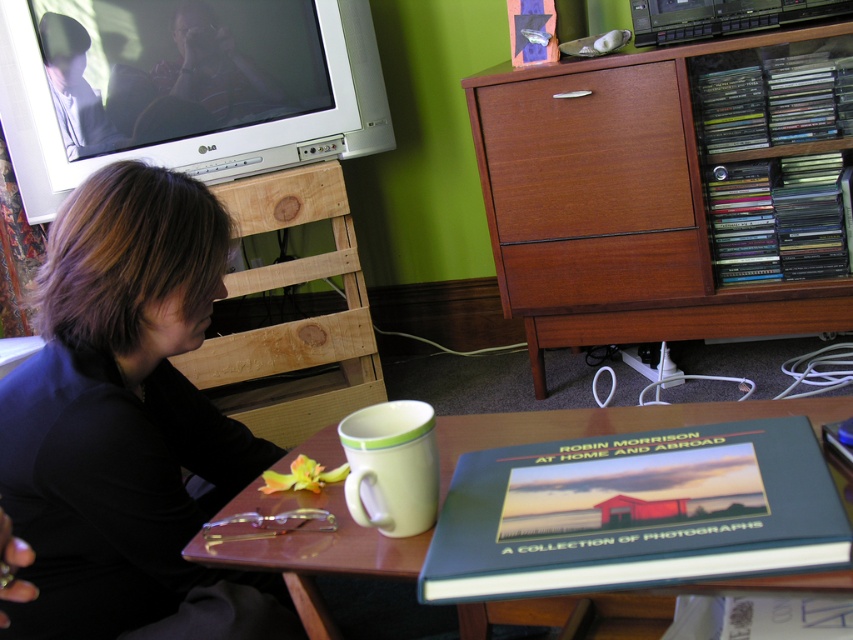
Question: Which of the following is the farthest from the observer?

Choices:
 (A) wooden drawer at upper right
 (B) wooden cabinet at upper right

Answer: (A)

Question: Which object appears closest to the camera in this image?

Choices:
 (A) wooden cabinet at upper right
 (B) black fabric shirt at left

Answer: (B)

Question: Considering the relative positions of wooden drawer at upper right and wooden table at lower center in the image provided, where is wooden drawer at upper right located with respect to wooden table at lower center?

Choices:
 (A) right
 (B) left

Answer: (A)

Question: Estimate the real-world distances between objects in this image. Which object is closer to the wooden cabinet at upper right?

Choices:
 (A) black fabric shirt at left
 (B) wooden table at lower center

Answer: (B)

Question: Considering the relative positions of wooden cabinet at upper right and wooden drawer at upper right in the image provided, where is wooden cabinet at upper right located with respect to wooden drawer at upper right?

Choices:
 (A) above
 (B) below

Answer: (B)

Question: Is black fabric shirt at left to the right of wooden table at lower center from the viewer's perspective?

Choices:
 (A) yes
 (B) no

Answer: (B)